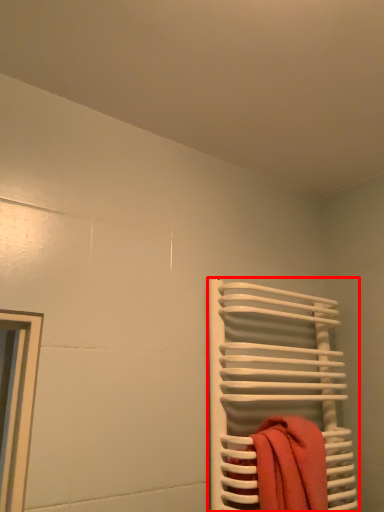
Question: Observing the image, what is the correct spatial positioning of towel rack (annotated by the red box) in reference to beach towel?

Choices:
 (A) left
 (B) right

Answer: (B)